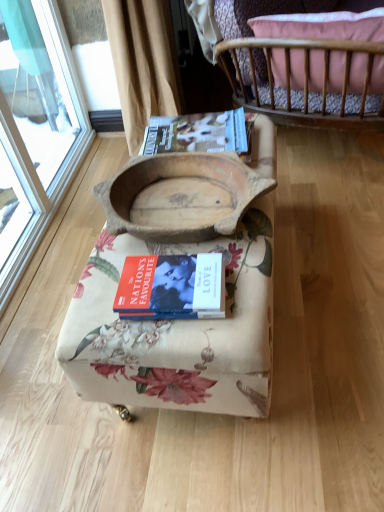
The width and height of the screenshot is (384, 512). Describe the element at coordinates (197, 133) in the screenshot. I see `hardcover magazine at upper center` at that location.

This screenshot has width=384, height=512. Describe the element at coordinates (176, 177) in the screenshot. I see `wooden bowl at center` at that location.

Find the location of `hardcover magazine at upper center`. hardcover magazine at upper center is located at coordinates (197, 133).

Are wooden bowl at center, acting as the 1th furniture starting from the bottom, and hardcover magazine at upper center far apart?

No, wooden bowl at center, acting as the 1th furniture starting from the bottom, is not far from hardcover magazine at upper center.

From a real-world perspective, is wooden bowl at center, arranged as the 2th furniture when viewed from the top, above or below hardcover magazine at upper center?

wooden bowl at center, arranged as the 2th furniture when viewed from the top, is below hardcover magazine at upper center.

Considering the sizes of wooden bowl at center, arranged as the 2th furniture when viewed from the top, and hardcover magazine at upper center in the image, is wooden bowl at center, arranged as the 2th furniture when viewed from the top, bigger or smaller than hardcover magazine at upper center?

Considering their sizes, wooden bowl at center, arranged as the 2th furniture when viewed from the top, takes up more space than hardcover magazine at upper center.

Is wooden bowl at center, arranged as the 2th furniture when viewed from the top, further to the viewer compared to hardcover magazine at upper center?

No, the depth of wooden bowl at center, arranged as the 2th furniture when viewed from the top, is less than that of hardcover magazine at upper center.

Looking at this image, from the image's perspective, relative to hardcover book at center, is wooden crib at upper right, which is the 1th furniture from top to bottom, above or below?

wooden crib at upper right, which is the 1th furniture from top to bottom, is above hardcover book at center.

From a real-world perspective, between wooden crib at upper right, which is the 1th furniture from top to bottom, and hardcover book at center, who is vertically lower?

hardcover book at center, from a real-world perspective.

Does point (156, 253) lie behind point (184, 159)?

No, it is not.

Is wooden bowl at center, arranged as the 2th furniture when viewed from the top, positioned before wooden bowl at center?

Yes, the depth of wooden bowl at center, arranged as the 2th furniture when viewed from the top, is less than that of wooden bowl at center.

From a real-world perspective, which object stands above the other?

wooden bowl at center.

From the image's perspective, who appears lower, wooden bowl at center or wooden crib at upper right, acting as the second furniture starting from the bottom?

wooden bowl at center is shown below in the image.

Considering the relative positions of wooden bowl at center and wooden crib at upper right, acting as the second furniture starting from the bottom, in the image provided, is wooden bowl at center to the left of wooden crib at upper right, acting as the second furniture starting from the bottom, from the viewer's perspective?

Yes.

Considering the relative sizes of wooden bowl at center and wooden crib at upper right, acting as the second furniture starting from the bottom, in the image provided, is wooden bowl at center bigger than wooden crib at upper right, acting as the second furniture starting from the bottom,?

No.

Looking at this image, which object is wider, wooden bowl at center or wooden crib at upper right, which is the 1th furniture from top to bottom?

wooden bowl at center is wider.

Which is behind, wooden crib at upper right, acting as the second furniture starting from the bottom, or hardcover magazine at upper center?

hardcover magazine at upper center is more distant.

Is hardcover magazine at upper center located within wooden crib at upper right, which is the 1th furniture from top to bottom?

Definitely not — hardcover magazine at upper center is not inside wooden crib at upper right, which is the 1th furniture from top to bottom.

Is wooden crib at upper right, acting as the second furniture starting from the bottom, shorter than hardcover magazine at upper center?

No, wooden crib at upper right, acting as the second furniture starting from the bottom, is not shorter than hardcover magazine at upper center.

Is hardcover magazine at upper center at the back of wooden crib at upper right, acting as the second furniture starting from the bottom?

Yes.

Does wooden crib at upper right, acting as the second furniture starting from the bottom, lie behind wooden bowl at center, acting as the 1th furniture starting from the bottom?

Yes, wooden crib at upper right, acting as the second furniture starting from the bottom, is further from the viewer.

Considering the relative sizes of wooden crib at upper right, which is the 1th furniture from top to bottom, and wooden bowl at center, acting as the 1th furniture starting from the bottom, in the image provided, is wooden crib at upper right, which is the 1th furniture from top to bottom, thinner than wooden bowl at center, acting as the 1th furniture starting from the bottom,?

Correct, the width of wooden crib at upper right, which is the 1th furniture from top to bottom, is less than that of wooden bowl at center, acting as the 1th furniture starting from the bottom.

From a real-world perspective, is wooden crib at upper right, acting as the second furniture starting from the bottom, on wooden bowl at center, acting as the 1th furniture starting from the bottom?

Correct, in the physical world, wooden crib at upper right, acting as the second furniture starting from the bottom, is higher than wooden bowl at center, acting as the 1th furniture starting from the bottom.

Is wooden crib at upper right, acting as the second furniture starting from the bottom, turned away from wooden bowl at center, acting as the 1th furniture starting from the bottom?

Yes.

Considering the sizes of objects hardcover magazine at upper center and wooden crib at upper right, acting as the second furniture starting from the bottom, in the image provided, who is shorter, hardcover magazine at upper center or wooden crib at upper right, acting as the second furniture starting from the bottom,?

hardcover magazine at upper center.

Identify the location of paperback book behind the wooden crib at upper right, which is the 1th furniture from top to bottom. (197, 133).

Is wooden crib at upper right, which is the 1th furniture from top to bottom, a part of hardcover magazine at upper center?

That's incorrect, wooden crib at upper right, which is the 1th furniture from top to bottom, is not inside hardcover magazine at upper center.

Can you confirm if hardcover magazine at upper center is thinner than wooden crib at upper right, which is the 1th furniture from top to bottom?

Yes, hardcover magazine at upper center is thinner than wooden crib at upper right, which is the 1th furniture from top to bottom.

Where is `paperback book above the wooden bowl at center, acting as the 1th furniture starting from the bottom (from the image's perspective)`? This screenshot has width=384, height=512. paperback book above the wooden bowl at center, acting as the 1th furniture starting from the bottom (from the image's perspective) is located at coordinates (197, 133).

What are the coordinates of `furniture located behind the hardcover book at center` in the screenshot? It's located at (299, 56).

Based on their spatial positions, is wooden bowl at center, arranged as the 2th furniture when viewed from the top, or wooden bowl at center further from wooden crib at upper right, acting as the second furniture starting from the bottom?

wooden bowl at center is positioned further to the anchor wooden crib at upper right, acting as the second furniture starting from the bottom.

From the image, which object appears to be nearer to hardcover magazine at upper center, wooden bowl at center or wooden bowl at center, arranged as the 2th furniture when viewed from the top?

wooden bowl at center is closer to hardcover magazine at upper center.

Looking at the image, which one is located further to hardcover magazine at upper center, hardcover book at center or wooden bowl at center, acting as the 1th furniture starting from the bottom?

hardcover book at center lies further to hardcover magazine at upper center than the other object.

When comparing their distances from wooden bowl at center, does hardcover magazine at upper center or hardcover book at center seem further?

Based on the image, hardcover book at center appears to be further to wooden bowl at center.

Which object lies further to the anchor point hardcover book at center, wooden bowl at center or wooden bowl at center, arranged as the 2th furniture when viewed from the top?

wooden bowl at center lies further to hardcover book at center than the other object.

When comparing their distances from wooden bowl at center, does hardcover book at center or wooden bowl at center, acting as the 1th furniture starting from the bottom, seem further?

hardcover book at center is further to wooden bowl at center.

Looking at the image, which one is located further to wooden bowl at center, hardcover book at center or hardcover magazine at upper center?

hardcover book at center.

Based on the photo, considering their positions, is hardcover book at center positioned closer to wooden bowl at center than wooden crib at upper right, acting as the second furniture starting from the bottom?

Based on the image, hardcover book at center appears to be nearer to wooden bowl at center.

Image resolution: width=384 pixels, height=512 pixels. I want to click on infant bed between wooden bowl at center, arranged as the 2th furniture when viewed from the top, and hardcover magazine at upper center, along the z-axis, so click(176, 177).

You are a GUI agent. You are given a task and a screenshot of the screen. Output one action in this format:
    pyautogui.click(x=<x>, y=<y>)
    Task: Click on the paperback book between wooden crib at upper right, acting as the second furniture starting from the bottom, and wooden bowl at center, acting as the 1th furniture starting from the bottom, in the up-down direction
    
    Given the screenshot: What is the action you would take?
    pyautogui.click(x=197, y=133)

Locate an element on the screen. This screenshot has width=384, height=512. furniture that lies between wooden bowl at center and hardcover book at center from top to bottom is located at coordinates (177, 330).

The image size is (384, 512). What are the coordinates of `paperback book between wooden crib at upper right, which is the 1th furniture from top to bottom, and wooden bowl at center, in the vertical direction` in the screenshot? It's located at (197, 133).